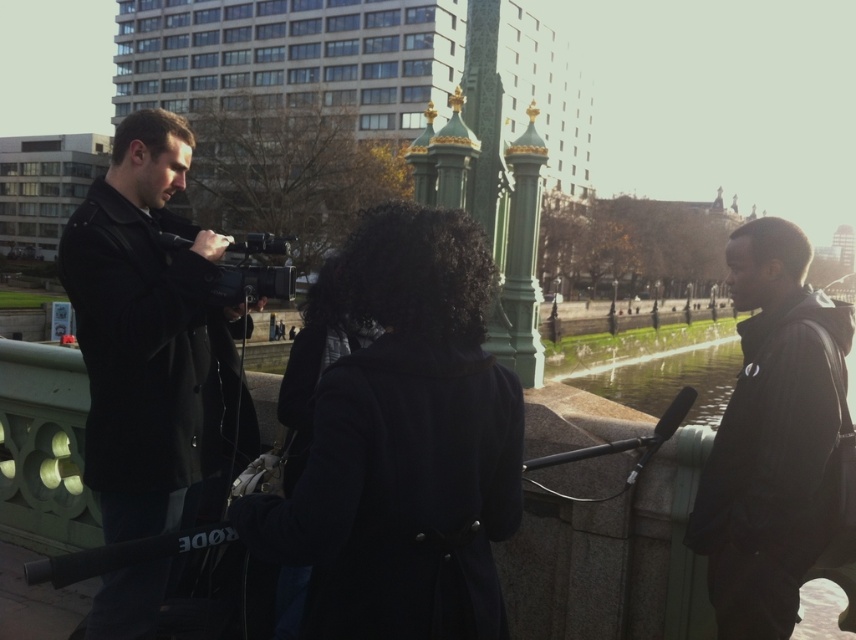
You are standing on the green bridge and want to take a photo of the black leather jacket at left and the black matte video camera at center. Which object is closer to you?

The black leather jacket at left is closer to you because it is in front of the black matte video camera at center.

You are a drone operator trying to capture a shot of the black leather jacket at left and the clear glass water at center. The drone has a maximum range of 40 meters. Can the drone safely capture both objects in a single shot without exceeding its range?

The black leather jacket at left and clear glass water at center are 44.72 meters apart from each other. Since the drone has a maximum range of 40 meters, it cannot safely capture both objects in a single shot without exceeding its range.